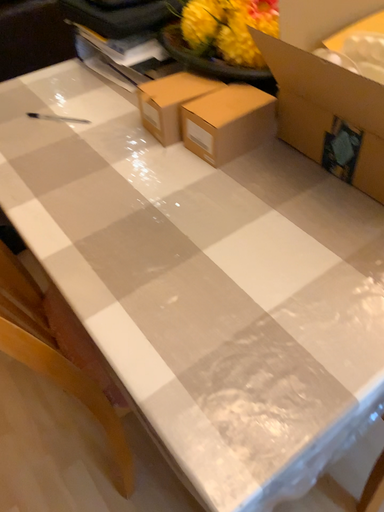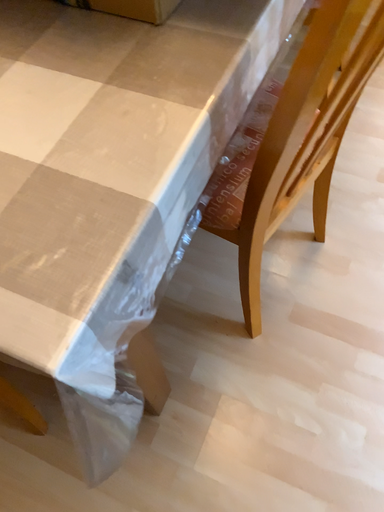
Question: How did the camera likely rotate when shooting the video?

Choices:
 (A) rotated upward
 (B) rotated downward

Answer: (B)